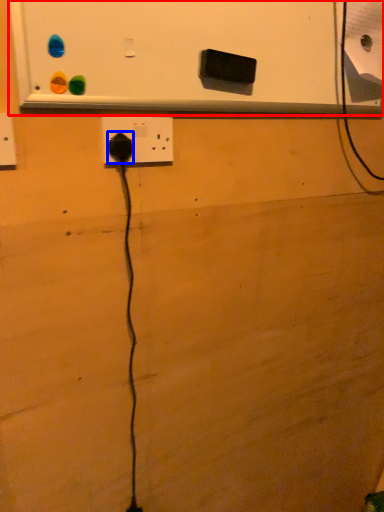
Question: Among these objects, which one is farthest to the camera, bulletin board (highlighted by a red box) or power plugs and sockets (highlighted by a blue box)?

Choices:
 (A) bulletin board
 (B) power plugs and sockets

Answer: (B)